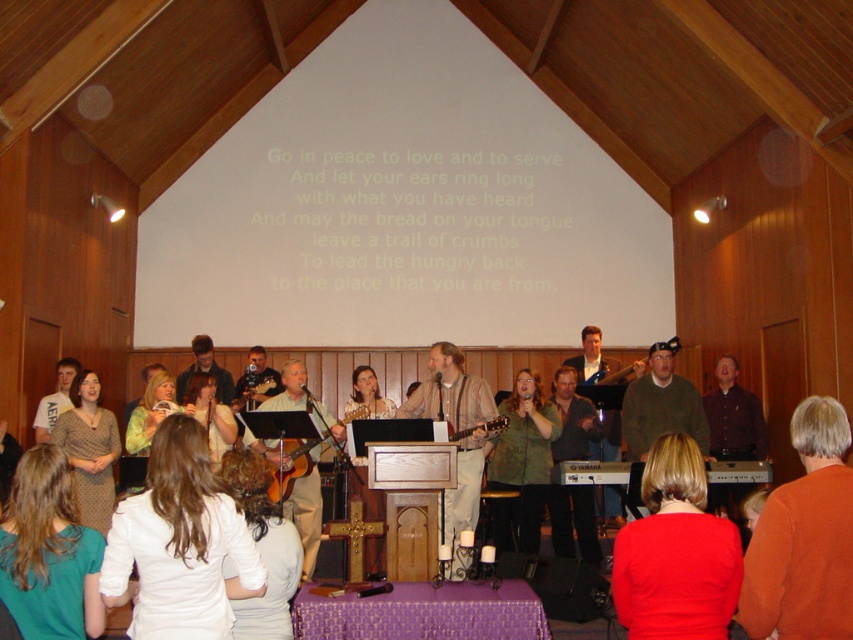
You are standing in the church and see the red matte sweater at lower right and the smooth beige sweater at center. Which one is located to the right of the other?

The red matte sweater at lower right is positioned on the right side of smooth beige sweater at center.

You are an attendee at the church service and you want to move to the stage area. You see the orange sweater at lower right and the green textured sweater at center. Which direction should you move to reach the stage first?

The orange sweater at lower right is located above the green textured sweater at center, so moving towards the orange sweater at lower right would lead you closer to the stage area first.

You are an interior designer planning to place a new sofa in this room. The sofa you have chosen is the same width as the smooth beige sweater at center. Will the red matte sweater at lower right fit on the same sofa without overlapping?

The red matte sweater at lower right is narrower than the smooth beige sweater at center, so it will fit on the sofa without overlapping since its width is smaller.